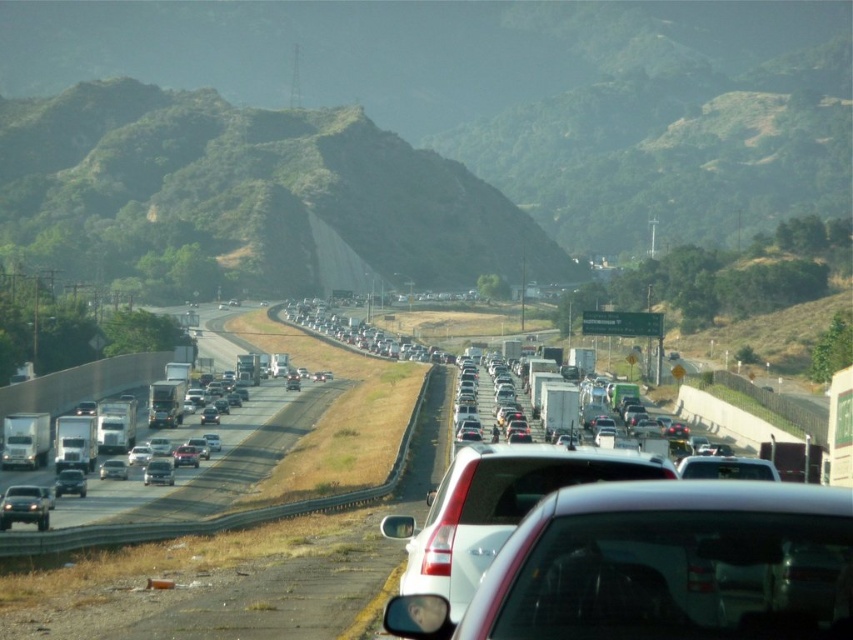
You are a traffic officer assessing the scene. You need to determine which vehicle takes up more space on the road between the metallic silver truck at left and the silver metallic sedan at center. Which one is bigger?

The metallic silver truck at left is larger in size than the silver metallic sedan at center, so it takes up more space on the road.

You are a pedestrian standing on the side of the road near the concrete barrier. You want to cross the highway to reach the hillside on the other side. The white glossy sedan at center is blocking your path. If you can only cross when there is a gap of at least 5 meters between you and the nearest vehicle, can you safely cross now?

The white glossy sedan at center and viewer are 6.17 meters apart from each other. Since the required gap is at least 5 meters, the distance of 6.17 meters is sufficient for safe crossing.